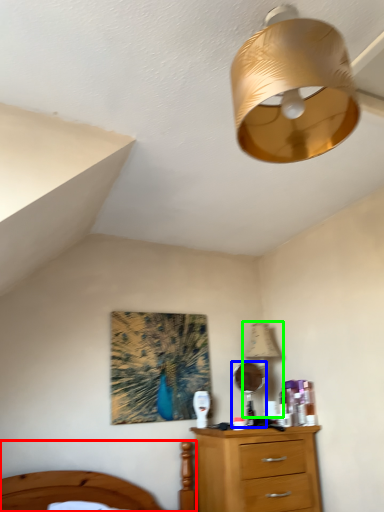
Question: Considering the real-world distances, which object is farthest from bed (highlighted by a red box)? mirror (highlighted by a blue box) or table lamp (highlighted by a green box)?

Choices:
 (A) mirror
 (B) table lamp

Answer: (B)